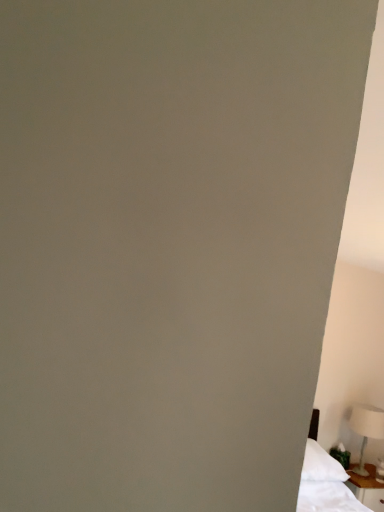
Question: From a real-world perspective, is white wood nightstand at lower right physically located above or below white plastic table lamp at lower right?

Choices:
 (A) above
 (B) below

Answer: (B)

Question: From their relative heights in the image, would you say white wood nightstand at lower right is taller or shorter than white plastic table lamp at lower right?

Choices:
 (A) short
 (B) tall

Answer: (A)

Question: Would you say white wood nightstand at lower right is to the left or to the right of white plastic table lamp at lower right in the picture?

Choices:
 (A) right
 (B) left

Answer: (B)

Question: Is white plastic table lamp at lower right to the left or to the right of white wood nightstand at lower right in the image?

Choices:
 (A) left
 (B) right

Answer: (B)

Question: From a real-world perspective, is white plastic table lamp at lower right above or below white wood nightstand at lower right?

Choices:
 (A) below
 (B) above

Answer: (B)

Question: From their relative heights in the image, would you say white plastic table lamp at lower right is taller or shorter than white wood nightstand at lower right?

Choices:
 (A) short
 (B) tall

Answer: (B)

Question: Is point (369, 436) positioned closer to the camera than point (372, 470)?

Choices:
 (A) closer
 (B) farther

Answer: (A)